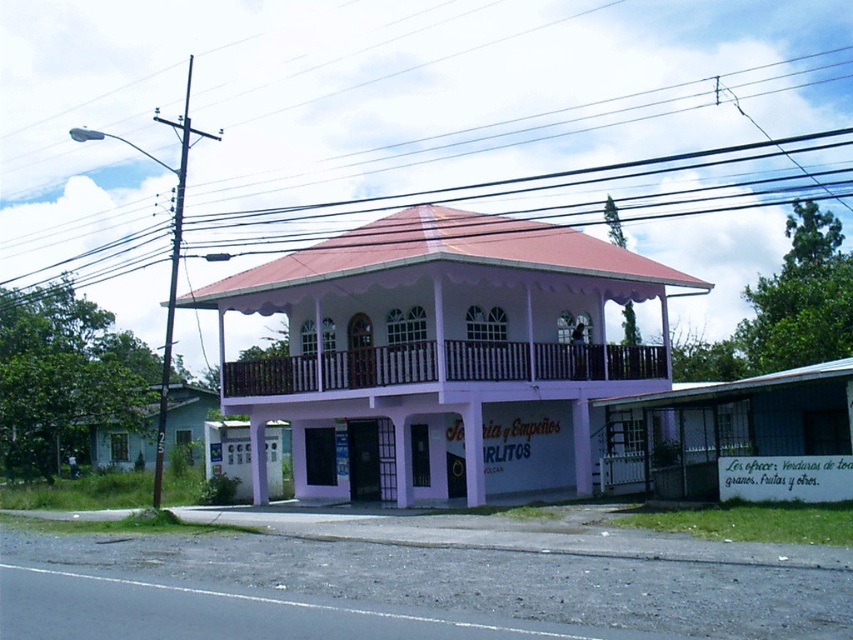
Can you confirm if white matte gazebo at center is positioned to the right of black wire at upper center?

Correct, you'll find white matte gazebo at center to the right of black wire at upper center.

Can you confirm if white matte gazebo at center is bigger than black wire at upper center?

Actually, white matte gazebo at center might be smaller than black wire at upper center.

Find the location of `white matte gazebo at center`. white matte gazebo at center is located at coordinates tap(440, 349).